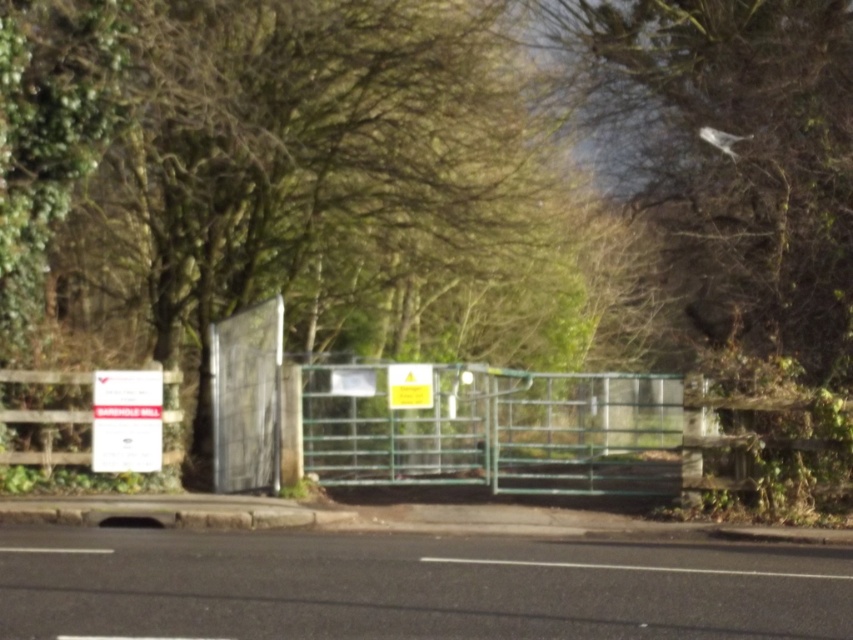
Can you confirm if white paper sign at upper left is smaller than yellow paper sign at center?

No, white paper sign at upper left is not smaller than yellow paper sign at center.

I want to click on white paper sign at upper left, so click(x=126, y=420).

Between white paper sign at upper left and wooden fence at left, which one is positioned lower?

wooden fence at left

Is point (109, 374) farther from viewer compared to point (16, 381)?

That is True.

Identify the location of white paper sign at upper left. The height and width of the screenshot is (640, 853). (126, 420).

Does green metal gate at center have a greater height compared to yellow paper sign at center?

Correct, green metal gate at center is much taller as yellow paper sign at center.

Where is `green metal gate at center`? green metal gate at center is located at coordinates (497, 429).

Identify the location of green metal gate at center. The width and height of the screenshot is (853, 640). (497, 429).